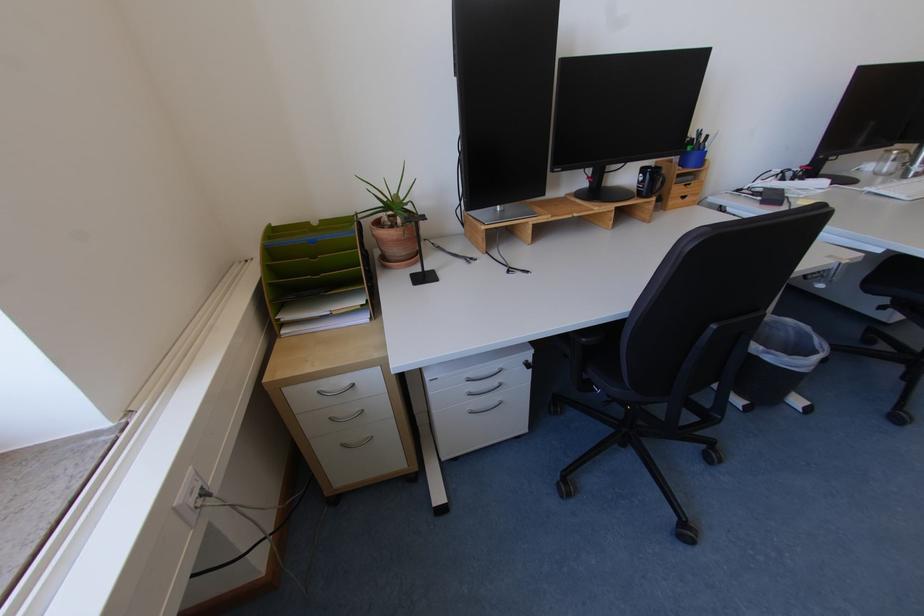
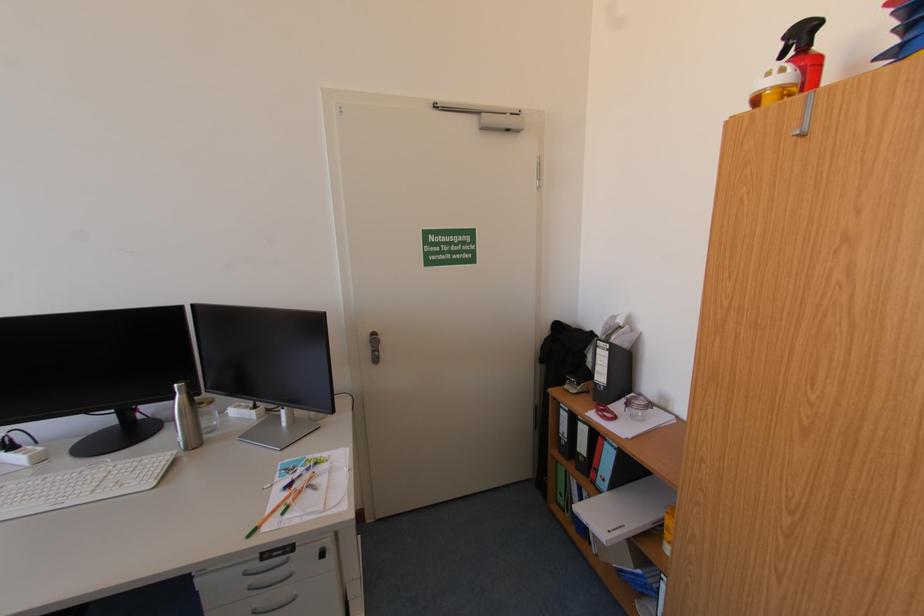
Question: The images are taken continuously from a first-person perspective. In which direction are you moving?

Choices:
 (A) Left
 (B) Right
 (C) Forward
 (D) Backward

Answer: (B)